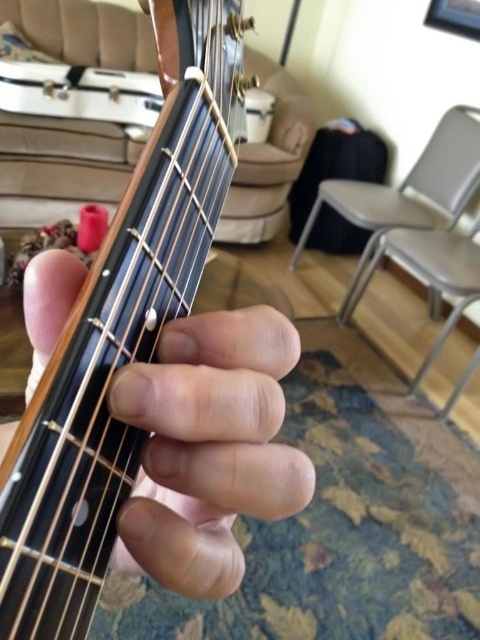
In the scene shown: Between wooden acoustic guitar at center and wooden guitar neck at center, which one appears on the left side from the viewer's perspective?

wooden guitar neck at center is more to the left.

Can you confirm if wooden acoustic guitar at center is bigger than wooden guitar neck at center?

Yes.

Is point (192, 154) positioned before point (240, 506)?

No.

The height and width of the screenshot is (640, 480). Identify the location of wooden acoustic guitar at center. (120, 332).